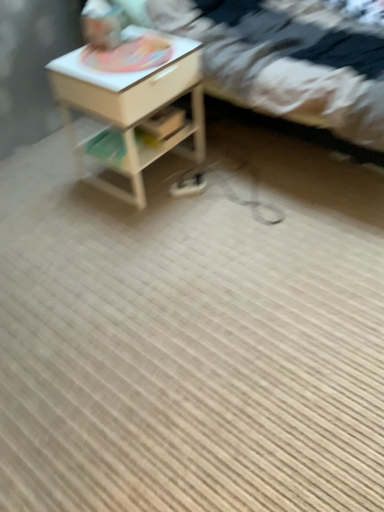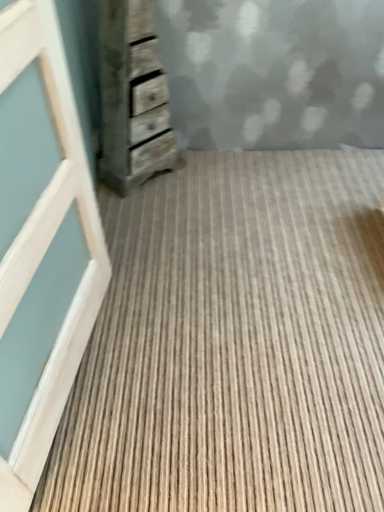
Question: How did the camera likely rotate when shooting the video?

Choices:
 (A) rotated downward
 (B) rotated upward

Answer: (B)